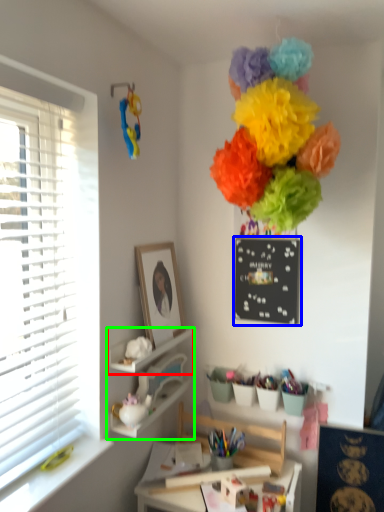
Question: Estimate the real-world distances between objects in this image. Which object is closer to shelf (highlighted by a red box), bulletin board (highlighted by a blue box) or shelf (highlighted by a green box)?

Choices:
 (A) bulletin board
 (B) shelf

Answer: (B)